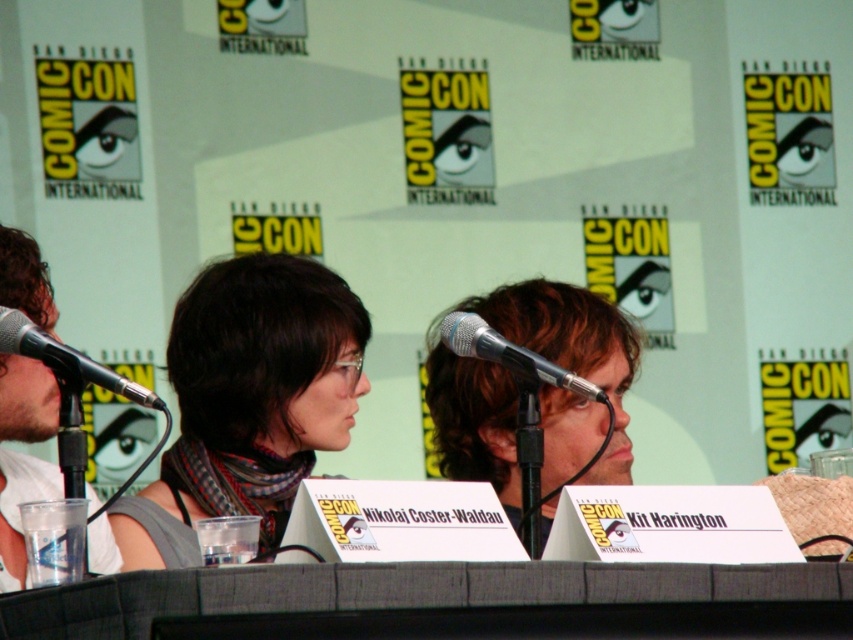
You are attending Comic Con and want to know if the gray fabric table at center is taller than the white matte shirt at left. Can you determine this based on the scene?

The gray fabric table at center is not as tall as the white matte shirt at left, so the white matte shirt at left is taller.

You are attending Comic Con and want to take a photo with the person with light brown hair at center. Where should you stand relative to the table to get the best shot?

The light brown hair at center is located at point [572,348], so you should stand directly in front of the table to capture the best angle of the light brown hair at center.

You are attending Comic Con and want to take a photo of the gray fabric table at center. Where should you position yourself to capture it in the best possible view?

The gray fabric table at center is located at point (442, 602), so you should position yourself directly in front of this coordinate to capture it in the best possible view.